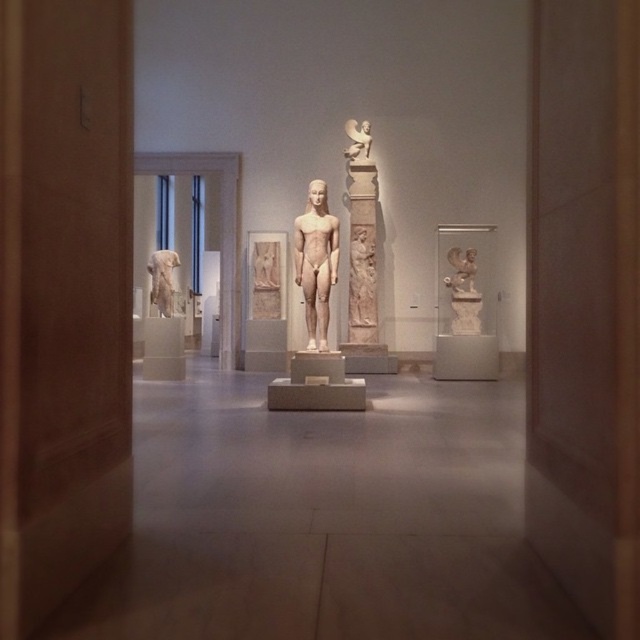
Does white marble statue at center appear on the left side of white marble relief at upper center?

Indeed, white marble statue at center is positioned on the left side of white marble relief at upper center.

Can you confirm if white marble statue at center is positioned below white marble relief at upper center?

Indeed, white marble statue at center is positioned under white marble relief at upper center.

Which is behind, point (304, 269) or point (371, 138)?

The point (371, 138) is behind.

The image size is (640, 640). Find the location of `white marble statue at center`. white marble statue at center is located at coordinates (316, 260).

Can you confirm if white marble statue at center-right is taller than white marble relief at upper center?

Indeed, white marble statue at center-right has a greater height compared to white marble relief at upper center.

Locate an element on the screen. white marble statue at center-right is located at coordinates (464, 291).

Locate an element on the screen. Image resolution: width=640 pixels, height=640 pixels. white marble statue at center-right is located at coordinates (464, 291).

The image size is (640, 640). What do you see at coordinates (316, 260) in the screenshot? I see `white marble statue at center` at bounding box center [316, 260].

Does point (300, 250) come closer to viewer compared to point (464, 285)?

Yes, it is in front of point (464, 285).

Identify the location of white marble statue at center. (316, 260).